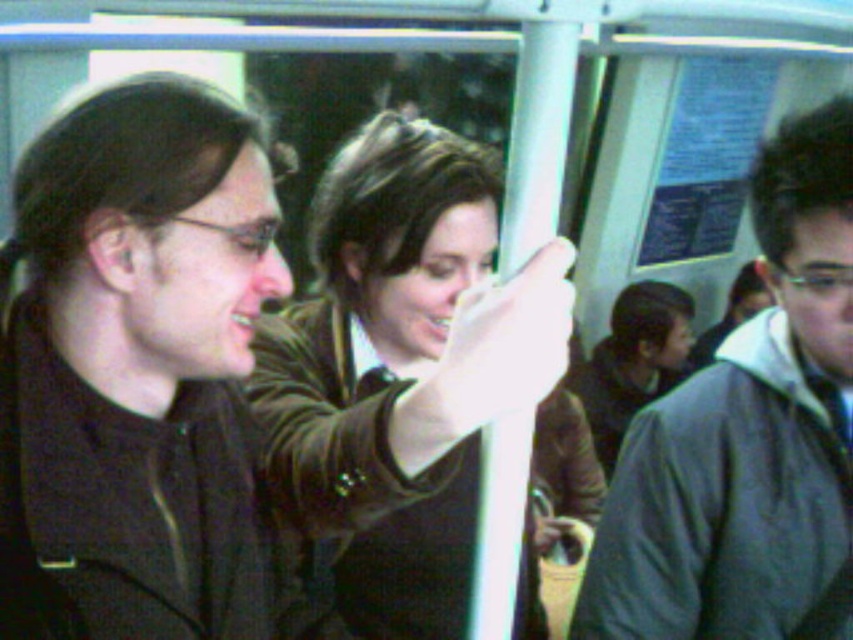
Question: Can you confirm if gray fabric jacket at right is smaller than white plastic pole at center?

Choices:
 (A) no
 (B) yes

Answer: (A)

Question: Which of these objects is positioned farthest from the gray fabric jacket at right?

Choices:
 (A) dark brown leather jacket at left
 (B) matte brown hair at center

Answer: (B)

Question: Can you confirm if brown leather jacket at center is thinner than white plastic pole at center?

Choices:
 (A) yes
 (B) no

Answer: (B)

Question: Among these objects, which one is farthest from the camera?

Choices:
 (A) dark brown leather jacket at left
 (B) gray fabric jacket at right

Answer: (B)

Question: Which object appears closest to the camera in this image?

Choices:
 (A) dark brown leather jacket at left
 (B) gray fabric jacket at right
 (C) matte brown hair at center
 (D) brown leather jacket at center

Answer: (D)

Question: Is dark brown leather jacket at left closer to camera compared to gray fabric jacket at right?

Choices:
 (A) yes
 (B) no

Answer: (A)